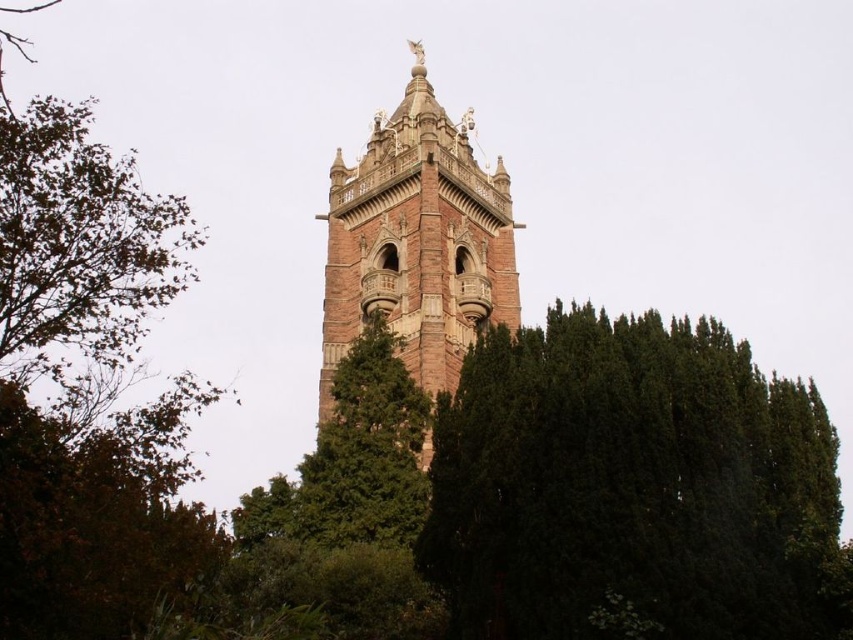
Identify the location of green leafy tree at center. (631, 486).

Is point (456, 625) positioned in front of point (323, 218)?

Yes, point (456, 625) is closer to viewer.

You are a GUI agent. You are given a task and a screenshot of the screen. Output one action in this format:
    pyautogui.click(x=<x>, y=<y>)
    Task: Click on the green leafy tree at center
    
    Given the screenshot: What is the action you would take?
    pyautogui.click(x=631, y=486)